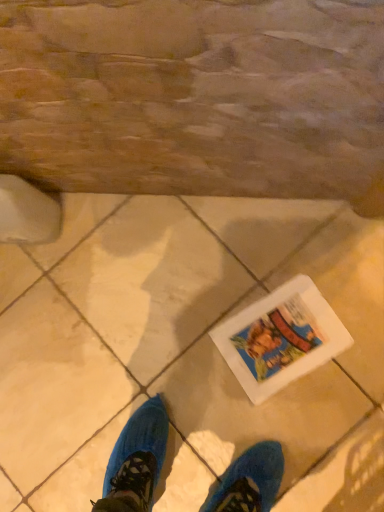
Identify the location of free space above white matte comic book at lower center (from a real-world perspective). (284, 338).